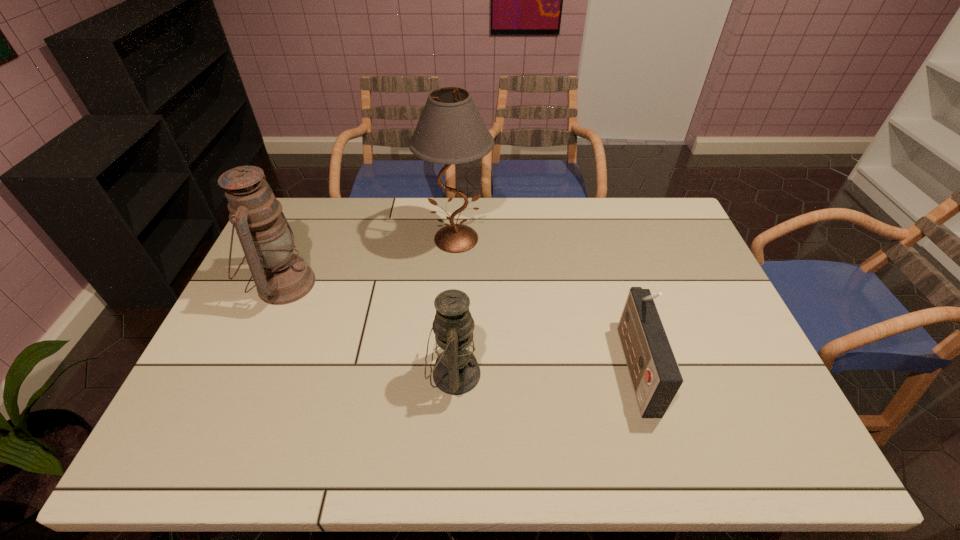
Where is `vacant area that lies between the radio receiver and the nearer oil lamp`? The height and width of the screenshot is (540, 960). vacant area that lies between the radio receiver and the nearer oil lamp is located at coordinates (544, 369).

Locate an element on the screen. free space between the rightmost object and the tallest object is located at coordinates (545, 302).

Identify the location of empty space that is in between the tallest object and the radio receiver. (545, 302).

This screenshot has height=540, width=960. In order to click on free space between the rightmost object and the shorter oil lamp in this screenshot , I will do `click(544, 369)`.

Find the location of a particular element. The image size is (960, 540). vacant area between the radio receiver and the tallest object is located at coordinates (545, 302).

The height and width of the screenshot is (540, 960). I want to click on free space between the rightmost object and the shorter oil lamp, so click(544, 369).

Locate an element on the screen. This screenshot has height=540, width=960. vacant area between the farther oil lamp and the right oil lamp is located at coordinates (369, 329).

Identify the location of vacant space that's between the second tallest object and the table lamp. Image resolution: width=960 pixels, height=540 pixels. (370, 261).

At what (x,y) coordinates should I click in order to perform the action: click on object that is the third closest to the farther oil lamp. Please return your answer as a coordinate pair (x, y). Looking at the image, I should click on (656, 378).

Locate which object is the closest to the rightmost object. Please provide its 2D coordinates. Your answer should be formatted as a tuple, i.e. [(x, y)], where the tuple contains the x and y coordinates of a point satisfying the conditions above.

[(456, 371)]